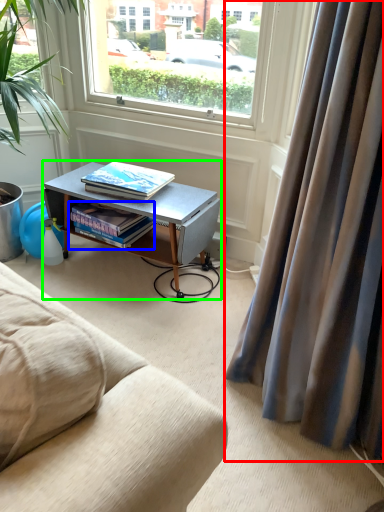
Question: Estimate the real-world distances between objects in this image. Which object is farther from curtain (highlighted by a red box), book (highlighted by a blue box) or desk (highlighted by a green box)?

Choices:
 (A) book
 (B) desk

Answer: (A)